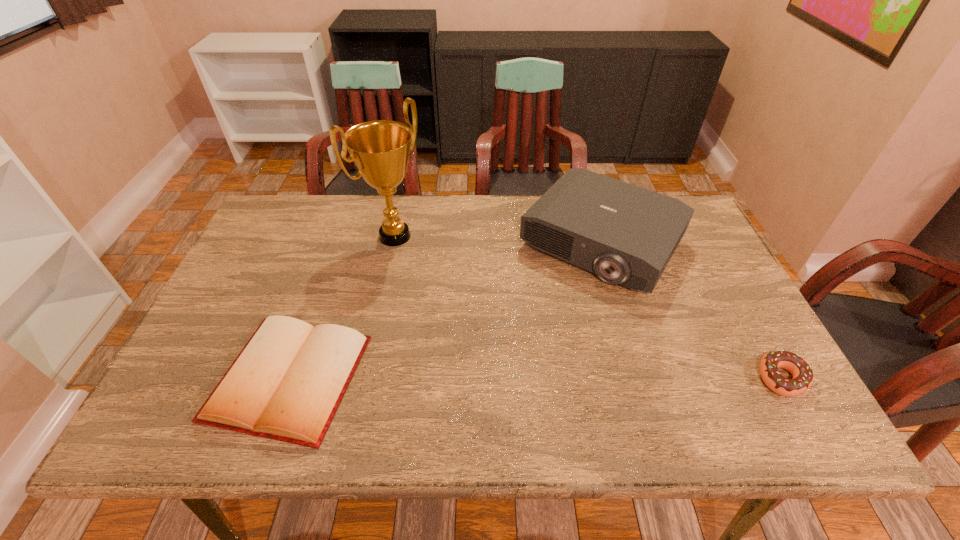
Identify the location of vacant space that's between the tallest object and the third object from left to right. The width and height of the screenshot is (960, 540). (498, 240).

Where is `free area in between the doughnut and the second object from right to left`? This screenshot has height=540, width=960. free area in between the doughnut and the second object from right to left is located at coordinates (691, 310).

Locate an element on the screen. The width and height of the screenshot is (960, 540). unoccupied position between the doughnut and the Bible is located at coordinates (536, 378).

Where is `vacant space that's between the tallest object and the projector`? vacant space that's between the tallest object and the projector is located at coordinates (498, 240).

Identify the location of vacant area that lies between the second object from right to left and the Bible. Image resolution: width=960 pixels, height=540 pixels. (445, 310).

What are the coordinates of `free space between the award and the doughnut` in the screenshot? It's located at (588, 307).

The image size is (960, 540). I want to click on free space between the doughnut and the award, so click(588, 307).

The width and height of the screenshot is (960, 540). In order to click on vacant space in between the Bible and the second tallest object in this screenshot , I will do `click(445, 310)`.

Locate an element on the screen. Image resolution: width=960 pixels, height=540 pixels. object that is the nearest to the award is located at coordinates point(286,384).

This screenshot has width=960, height=540. Identify the location of object that is the closest one to the award. (286, 384).